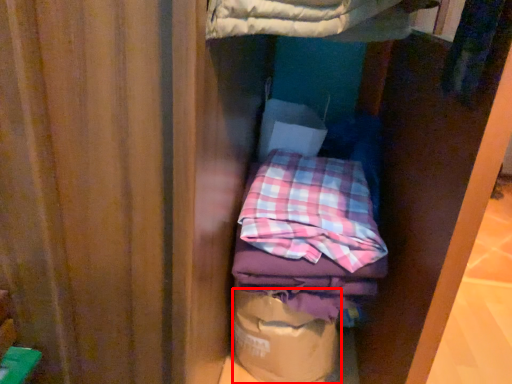
Question: Observing the image, what is the correct spatial positioning of paper bag (annotated by the red box) in reference to flannel?

Choices:
 (A) left
 (B) right

Answer: (A)